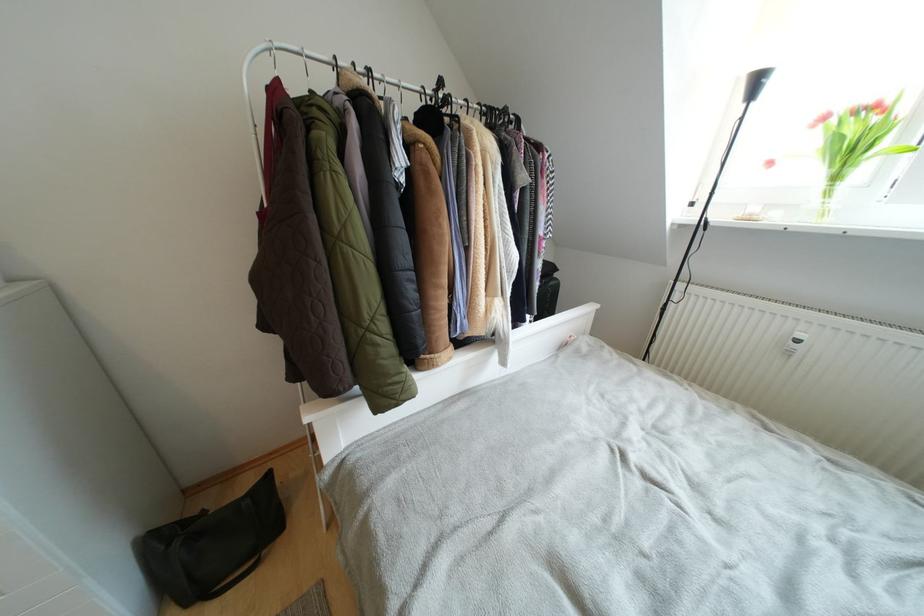
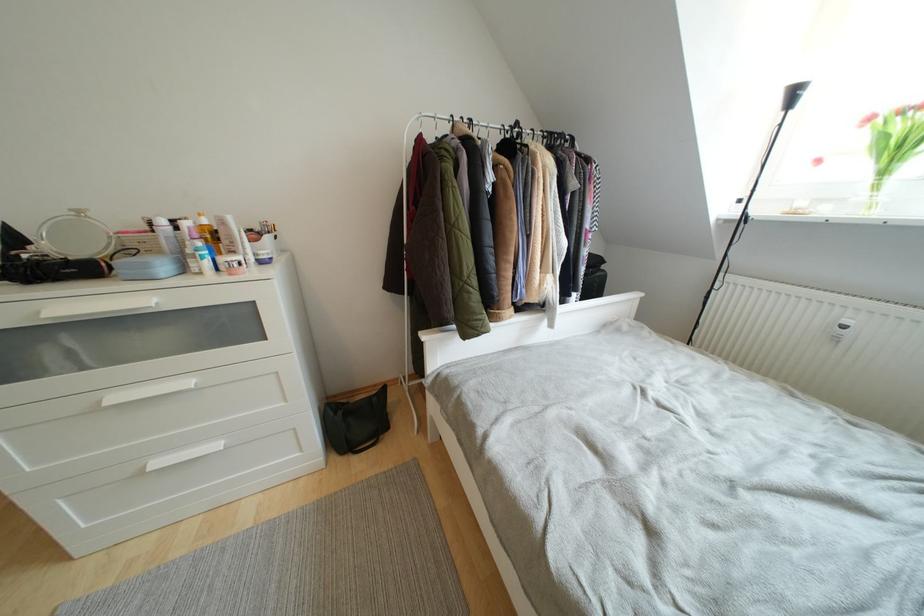
Locate, in the second image, the point that corresponds to pixel 840 182 in the first image.

(890, 176)